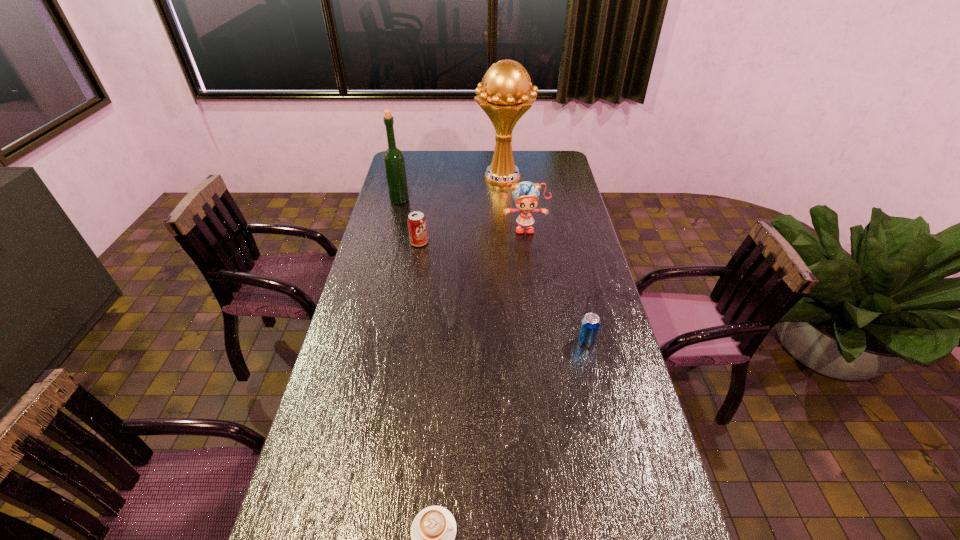
Point out which object is positioned as the third nearest to the tallest object. Please provide its 2D coordinates. Your answer should be formatted as a tuple, i.e. [(x, y)], where the tuple contains the x and y coordinates of a point satisfying the conditions above.

[(417, 227)]

Image resolution: width=960 pixels, height=540 pixels. I want to click on blank space that satisfies the following two spatial constraints: 1. on the face of the rightmost object; 2. on the left side of the doll, so click(538, 342).

You are a GUI agent. You are given a task and a screenshot of the screen. Output one action in this format:
    pyautogui.click(x=<x>, y=<y>)
    Task: Click on the free space that satisfies the following two spatial constraints: 1. at the front of the rightmost object where the globe is prominent; 2. on the left side of the tallest object
    The height and width of the screenshot is (540, 960).
    Given the screenshot: What is the action you would take?
    pyautogui.click(x=516, y=342)